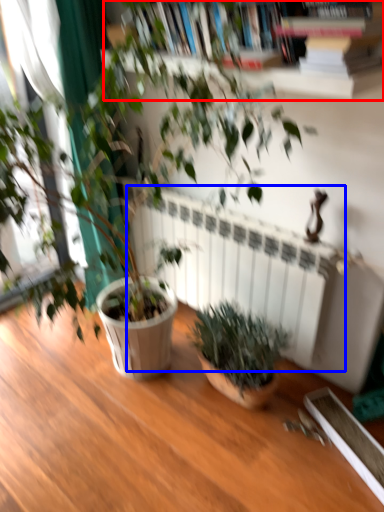
Question: Which object appears farthest to the camera in this image, bookcase (highlighted by a red box) or radiator (highlighted by a blue box)?

Choices:
 (A) bookcase
 (B) radiator

Answer: (B)